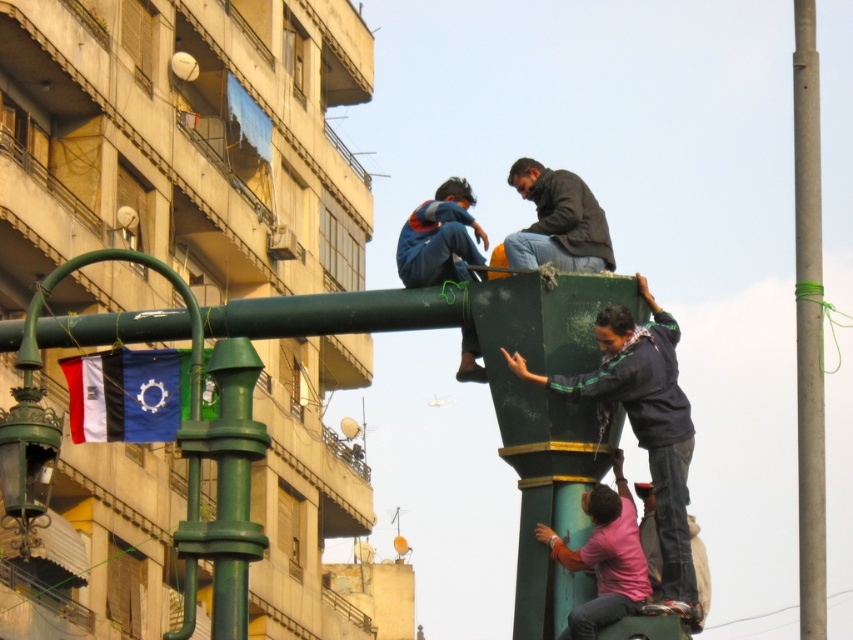
Question: Does smooth green pole at right have a larger size compared to pink matte shirt at lower center?

Choices:
 (A) no
 (B) yes

Answer: (B)

Question: Which object is farther from the camera taking this photo?

Choices:
 (A) dark blue fabric at upper center
 (B) dark brown leather jacket at upper center
 (C) green painted metal pole at left

Answer: (B)

Question: Does smooth green pole at right have a larger size compared to pink matte shirt at lower center?

Choices:
 (A) no
 (B) yes

Answer: (B)

Question: Does dark blue fabric at upper center have a larger size compared to smooth green pole at right?

Choices:
 (A) no
 (B) yes

Answer: (A)

Question: Based on their relative distances, which object is farther from the smooth green pole at right?

Choices:
 (A) dark blue fabric at upper center
 (B) dark brown leather jacket at upper center
 (C) green painted metal pole at left
 (D) pink matte shirt at lower center

Answer: (B)

Question: Considering the real-world distances, which object is farthest from the smooth green pole at right?

Choices:
 (A) pink matte shirt at lower center
 (B) dark brown leather jacket at upper center
 (C) green painted metal pole at left

Answer: (B)